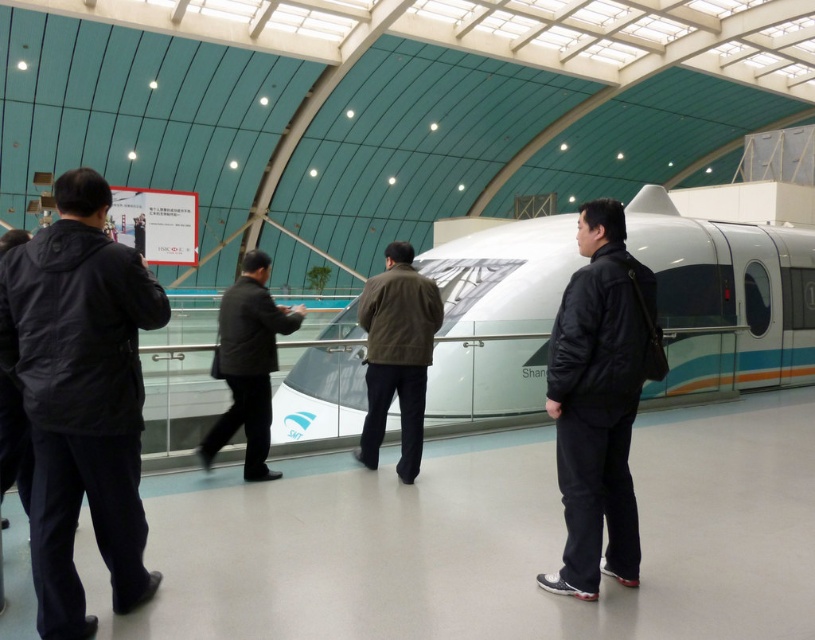
Is dark brown leather jacket at center bigger than dark gray jacket at left?

Correct, dark brown leather jacket at center is larger in size than dark gray jacket at left.

Consider the image. Is the position of dark brown leather jacket at center more distant than that of dark gray jacket at left?

Yes.

At what (x,y) coordinates should I click in order to perform the action: click on dark brown leather jacket at center. Please return your answer as a coordinate pair (x, y). This screenshot has height=640, width=815. Looking at the image, I should click on (397, 355).

Find the location of `dark brown leather jacket at center`. dark brown leather jacket at center is located at coordinates (397, 355).

Who is more distant from viewer, (7, 365) or (15, 428)?

Positioned behind is point (15, 428).

Does black matte jacket at left have a lesser width compared to dark gray jacket at left?

In fact, black matte jacket at left might be wider than dark gray jacket at left.

You are a GUI agent. You are given a task and a screenshot of the screen. Output one action in this format:
    pyautogui.click(x=<x>, y=<y>)
    Task: Click on the black matte jacket at left
    Image resolution: width=815 pixels, height=640 pixels.
    Given the screenshot: What is the action you would take?
    pyautogui.click(x=82, y=397)

Locate an element on the screen. The height and width of the screenshot is (640, 815). black matte jacket at left is located at coordinates (82, 397).

Which is behind, point (763, 326) or point (97, 224)?

The point (763, 326) is behind.

Locate an element on the screen. The width and height of the screenshot is (815, 640). white glossy train at center is located at coordinates (725, 296).

Where is `white glossy train at center`? The height and width of the screenshot is (640, 815). white glossy train at center is located at coordinates (725, 296).